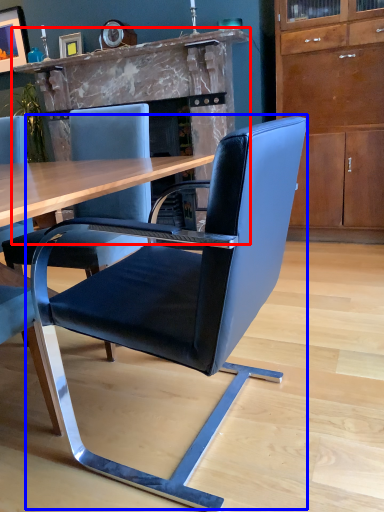
Question: Which object is closer to the camera taking this photo, fireplace (highlighted by a red box) or chair (highlighted by a blue box)?

Choices:
 (A) fireplace
 (B) chair

Answer: (B)